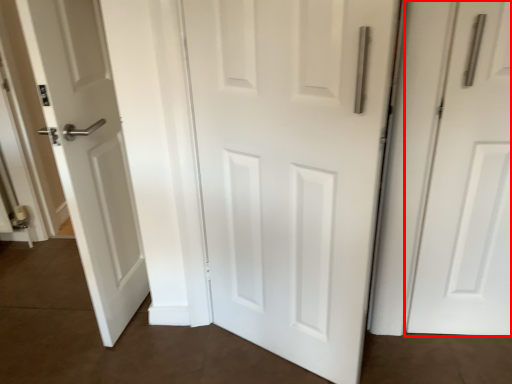
Question: From the image, what is the correct spatial relationship of door (annotated by the red box) in relation to door?

Choices:
 (A) right
 (B) left

Answer: (A)